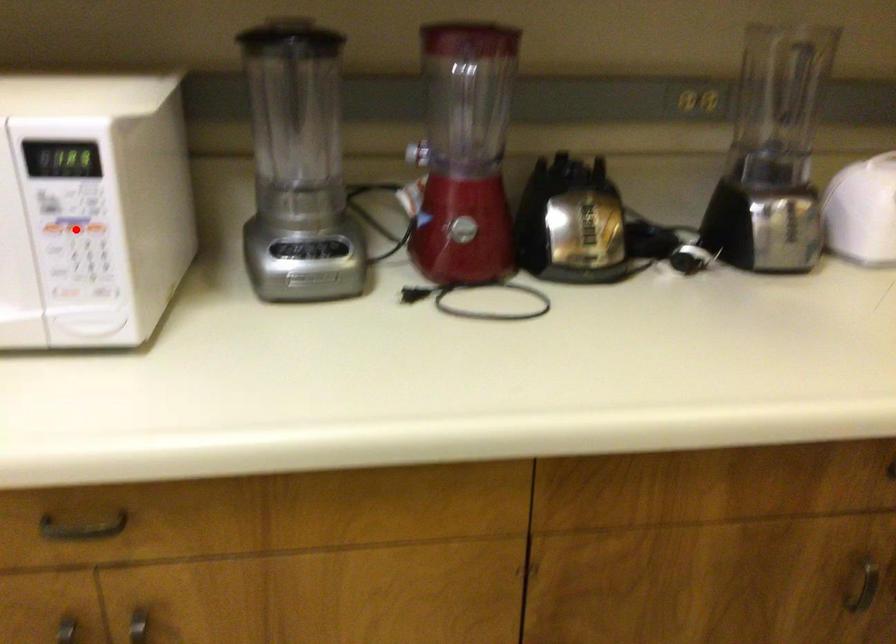
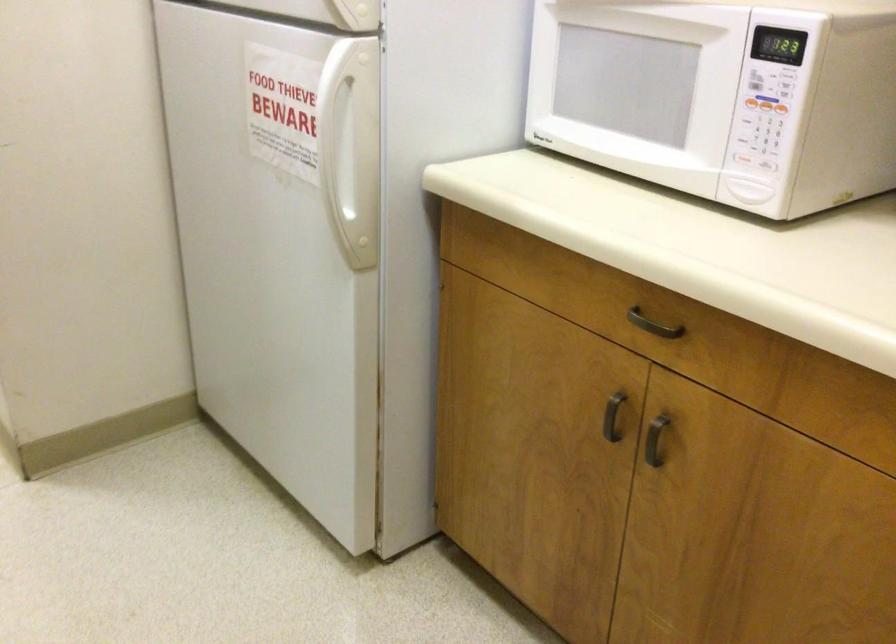
Where in the second image is the point corresponding to the highlighted location from the first image?

(765, 104)